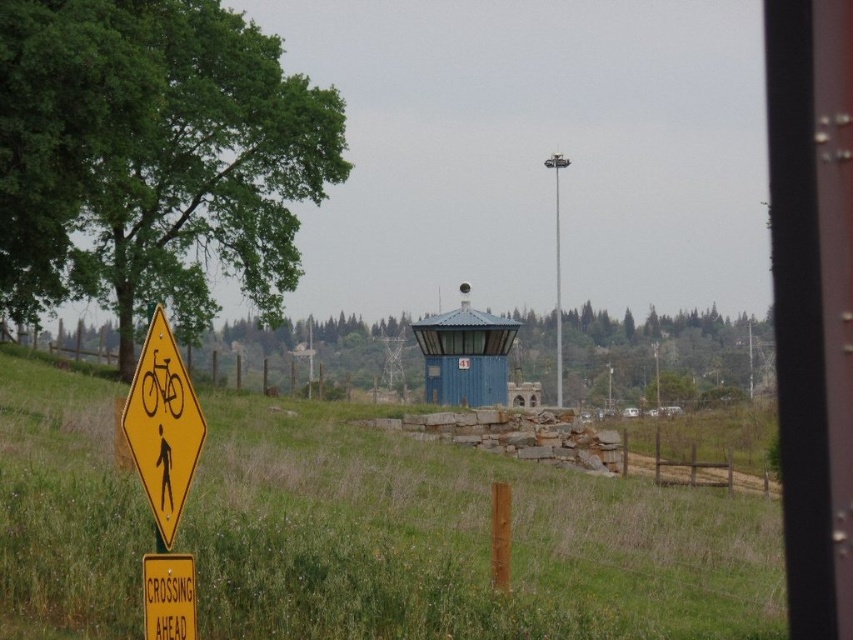
You are a hiker walking along the path and see the yellow plastic diamond at left and the yellow plastic sign at lower left. Which one is more to the left?

The yellow plastic diamond at left is more to the left than the yellow plastic sign at lower left.

In the scene shown: You are a hiker walking along the path and see the yellow plastic diamond at left and the brushed metal pole at upper center. Which object is shorter?

The yellow plastic diamond at left is shorter than the brushed metal pole at upper center.